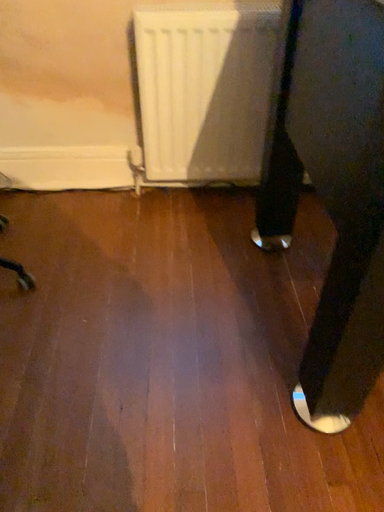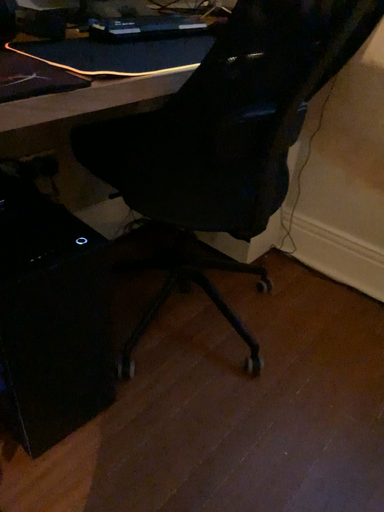
Question: How did the camera likely rotate when shooting the video?

Choices:
 (A) rotated right
 (B) rotated left

Answer: (B)